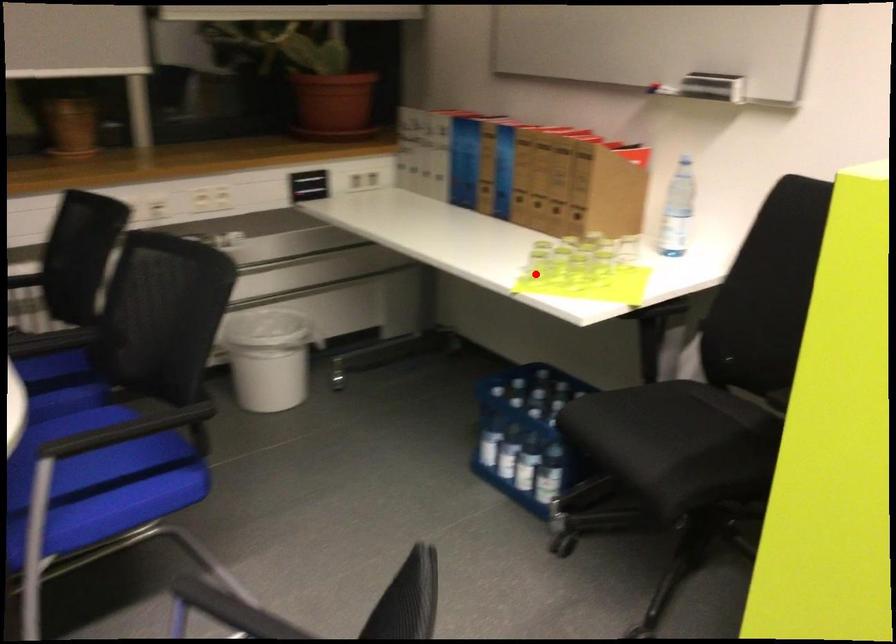
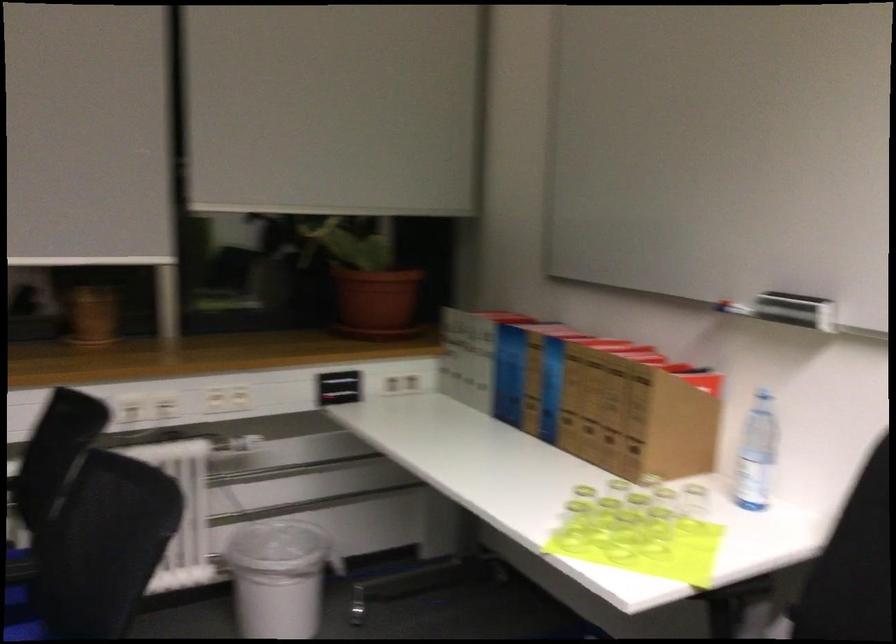
Question: A red point is marked in image1. In image2, is the corresponding 3D point closer to the camera or farther? Reply with the corresponding letter.

Choices:
 (A) The corresponding 3D point is closer.
 (B) The corresponding 3D point is farther.

Answer: (A)